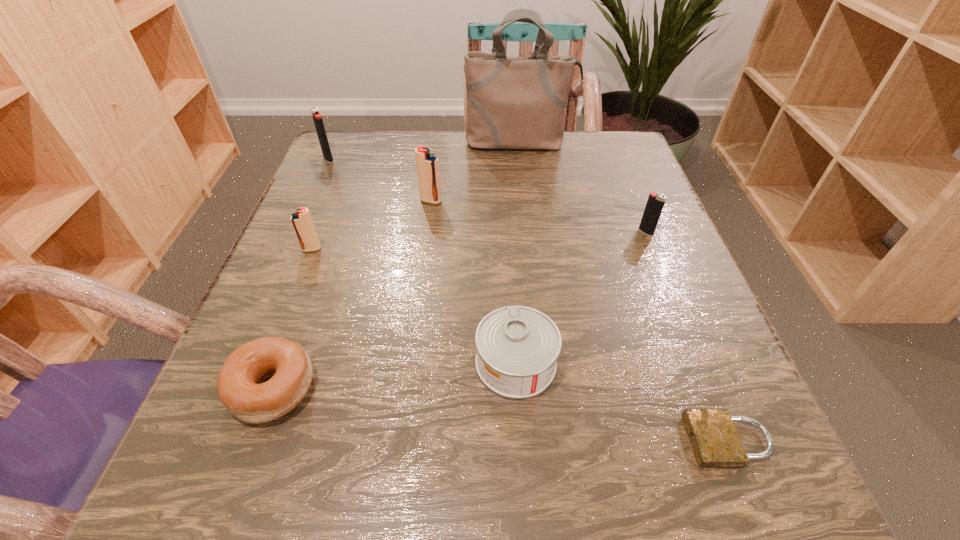
I want to click on object that is the seventh closest to the farther black igniter, so click(x=715, y=441).

Locate an element on the screen. igniter object that ranks as the third closest to the nearer red igniter is located at coordinates (655, 203).

What are the coordinates of `igniter that can be found as the second closest to the bagel` in the screenshot? It's located at [427, 163].

Where is `vacant area that satisfies the following two spatial constraints: 1. on the front side of the left black igniter; 2. on the left side of the rightmost igniter`? vacant area that satisfies the following two spatial constraints: 1. on the front side of the left black igniter; 2. on the left side of the rightmost igniter is located at coordinates 296,232.

This screenshot has height=540, width=960. Find the location of `free space that satisfies the following two spatial constraints: 1. on the front side of the nearer red igniter; 2. on the left side of the bagel`. free space that satisfies the following two spatial constraints: 1. on the front side of the nearer red igniter; 2. on the left side of the bagel is located at coordinates (258, 387).

The image size is (960, 540). What are the coordinates of `vacant space that satisfies the following two spatial constraints: 1. on the front side of the fifth nearest object; 2. on the keyhole side of the shortest object` in the screenshot? It's located at (730, 441).

Locate an element on the screen. Image resolution: width=960 pixels, height=540 pixels. free region that satisfies the following two spatial constraints: 1. on the back side of the smaller red igniter; 2. on the left side of the rightmost igniter is located at coordinates click(x=319, y=232).

Identify the location of vacant region that satisfies the following two spatial constraints: 1. on the front-facing side of the second nearest igniter; 2. on the left side of the tallest object. (530, 232).